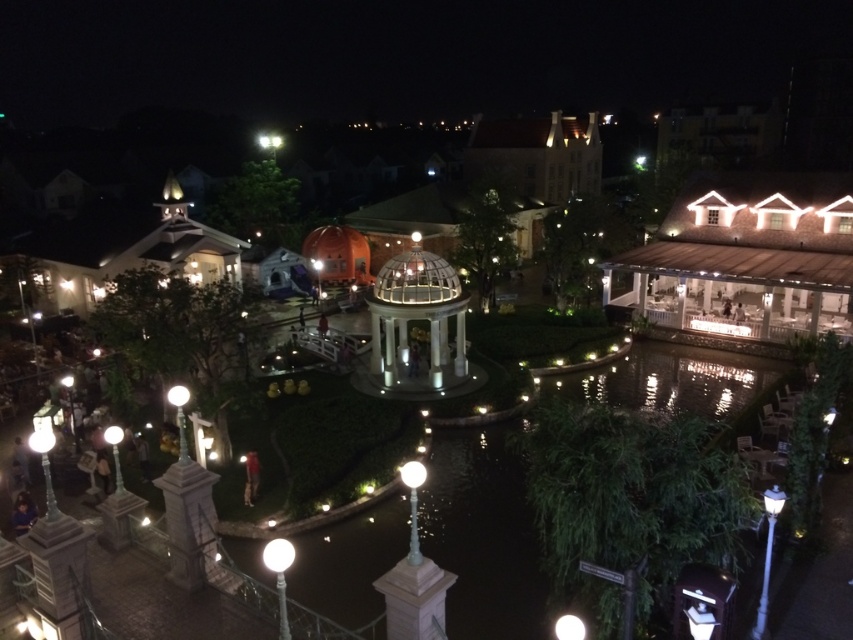
In the scene shown: Is clear water at center smaller than white glass gazebo at center?

No, clear water at center is not smaller than white glass gazebo at center.

Is point (363, 568) more distant than point (436, 385)?

No, (363, 568) is in front of (436, 385).

Which is behind, point (640, 388) or point (463, 376)?

The point (640, 388) is more distant.

Locate an element on the screen. Image resolution: width=853 pixels, height=640 pixels. clear water at center is located at coordinates (485, 532).